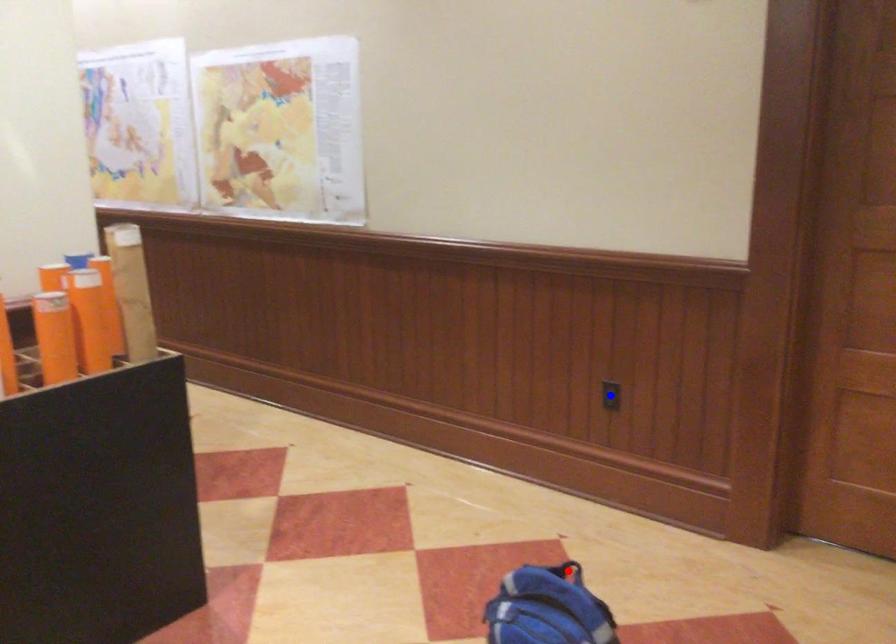
Question: Which of the two points in the image is closer to the camera?

Choices:
 (A) Blue point is closer.
 (B) Red point is closer.

Answer: (B)